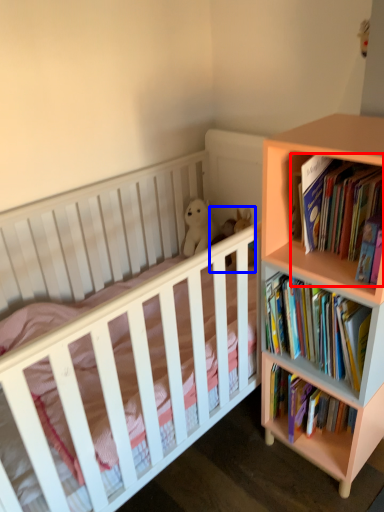
Question: Which point is further to the camera, book (highlighted by a red box) or toy (highlighted by a blue box)?

Choices:
 (A) book
 (B) toy

Answer: (B)